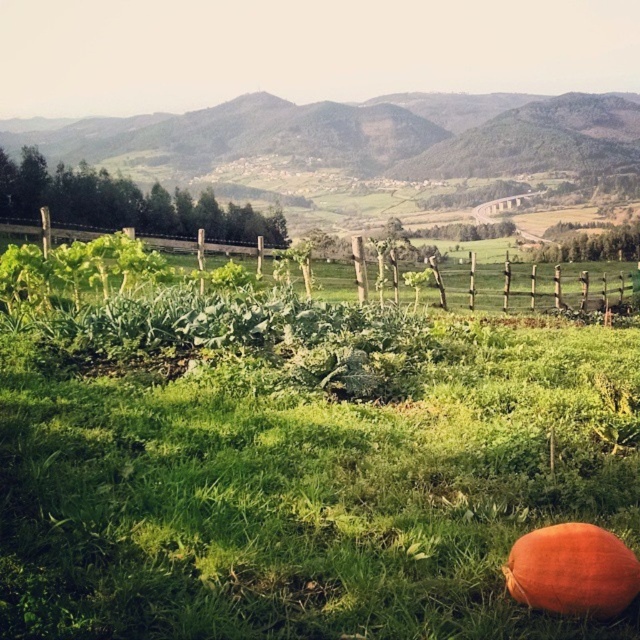
Question: Which point is closer to the camera?

Choices:
 (A) (554, 476)
 (B) (563, 161)

Answer: (A)

Question: Among these objects, which one is farthest from the camera?

Choices:
 (A) wooden posts at center
 (B) green grassy at center
 (C) green grassy hillside at center

Answer: (C)

Question: Is green grassy hillside at center further to camera compared to orange matte pumpkin at lower right?

Choices:
 (A) yes
 (B) no

Answer: (A)

Question: Does green grassy at center appear on the right side of orange matte pumpkin at lower right?

Choices:
 (A) yes
 (B) no

Answer: (B)

Question: Which is farther from the green grassy at center?

Choices:
 (A) green grassy hillside at center
 (B) wooden posts at center
 (C) orange matte pumpkin at lower right

Answer: (A)

Question: Is green grassy at center bigger than orange matte pumpkin at lower right?

Choices:
 (A) no
 (B) yes

Answer: (B)